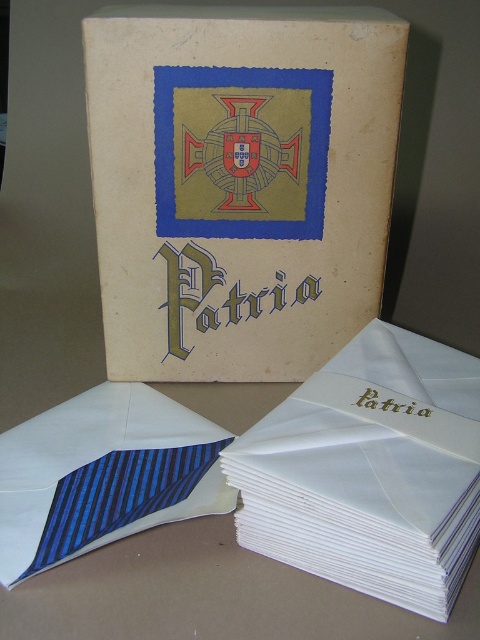
You are organizing a formal event and need to place the matte cardboard box at center and the blue striped tie at lower left on a table. Based on their positions in the image, which item should you place first to maintain the correct spatial arrangement?

The blue striped tie at lower left should be placed first since the matte cardboard box at center is to the right of it, ensuring proper positioning.

You are a mail carrier who needs to deliver a package to the beige box. You have two items in your bag, a white paper book at center and a blue striped tie at lower left. Which item is easier to reach because it is closer to you?

The white paper book at center is closer to the viewer than the blue striped tie at lower left, so it is easier to reach.